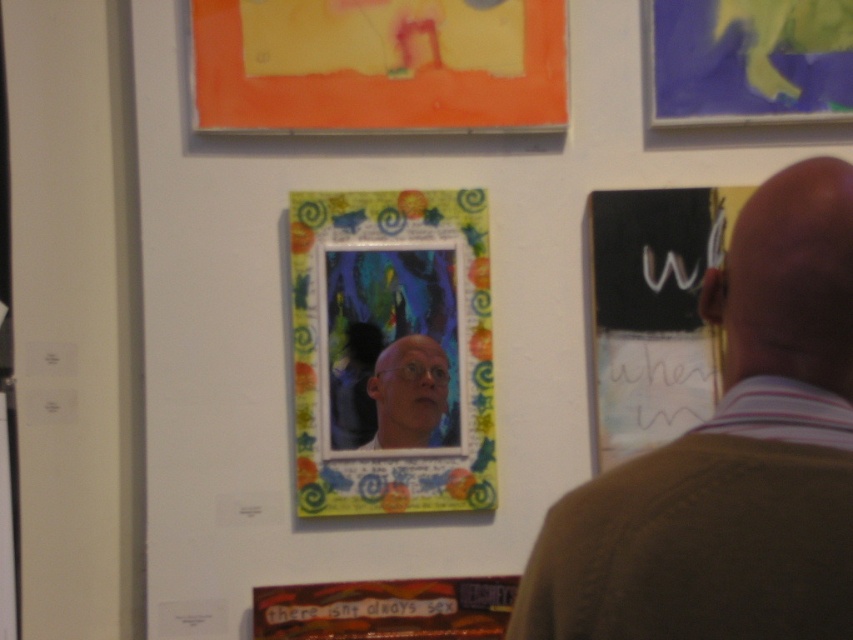
Does orange matte poster at upper center have a greater width compared to matte yellow sculpture at upper right?

Yes.

The height and width of the screenshot is (640, 853). Identify the location of orange matte poster at upper center. coord(379,65).

Which is more to the right, multicolored painted frame at center or matte yellow sculpture at upper right?

From the viewer's perspective, matte yellow sculpture at upper right appears more on the right side.

Can you confirm if multicolored painted frame at center is wider than matte yellow sculpture at upper right?

In fact, multicolored painted frame at center might be narrower than matte yellow sculpture at upper right.

Is point (335, 268) positioned in front of point (657, 100)?

That is True.

At what (x,y) coordinates should I click in order to perform the action: click on multicolored painted frame at center. Please return your answer as a coordinate pair (x, y). The height and width of the screenshot is (640, 853). Looking at the image, I should click on (392, 352).

Measure the distance between point [767,608] and camera.

They are 38.29 inches apart.

Who is taller, bald head at center or matte bald man at center?

With more height is bald head at center.

I want to click on bald head at center, so click(730, 458).